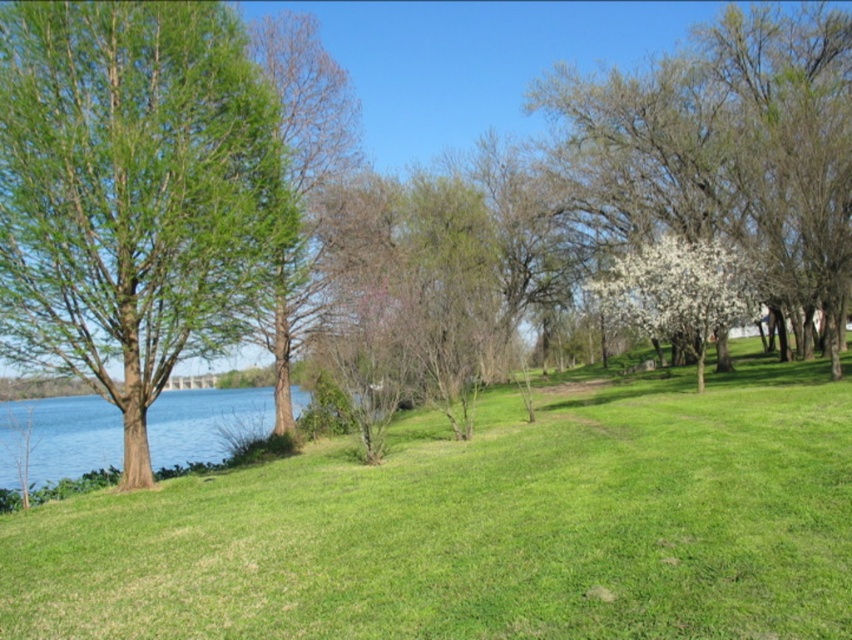
Which is more to the left, green grassy at lower left or green leafy tree at left?

Positioned to the left is green leafy tree at left.

In the scene shown: Can you confirm if green grassy at lower left is smaller than green leafy tree at left?

No, green grassy at lower left is not smaller than green leafy tree at left.

Does point (818, 445) come in front of point (125, 451)?

Yes, point (818, 445) is closer to viewer.

In order to click on green grassy at lower left in this screenshot , I will do `click(482, 528)`.

Between green leafy tree at left and white blossoming tree at center-right, which one is positioned higher?

white blossoming tree at center-right is above.

Between green leafy tree at left and white blossoming tree at center-right, which one is positioned lower?

Positioned lower is green leafy tree at left.

Describe the element at coordinates (130, 192) in the screenshot. I see `green leafy tree at left` at that location.

Identify the location of green leafy tree at left. click(130, 192).

Between green leafy tree at left and white blossoming tree at center, which one has less height?

green leafy tree at left is shorter.

Is point (9, 284) farther from viewer compared to point (809, 154)?

That is False.

The width and height of the screenshot is (852, 640). What are the coordinates of `green leafy tree at left` in the screenshot? It's located at (130, 192).

This screenshot has width=852, height=640. I want to click on green leafy tree at left, so click(130, 192).